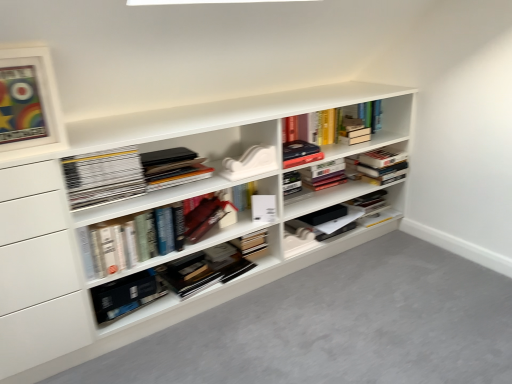
Question: Does white matte paperback book at center, positioned as the 1th paperback book in right-to-left order, have a greater width compared to white matte bookshelf at center?

Choices:
 (A) yes
 (B) no

Answer: (B)

Question: Is white matte paperback book at center, the 2th paperback book ordered from the bottom, next to white matte bookshelf at center?

Choices:
 (A) yes
 (B) no

Answer: (B)

Question: Is the position of white matte paperback book at center, the first paperback book viewed from the top, more distant than that of white matte bookshelf at center?

Choices:
 (A) no
 (B) yes

Answer: (B)

Question: Considering the relative positions of white matte paperback book at center, the second paperback book in the left-to-right sequence, and white matte bookshelf at center in the image provided, is white matte paperback book at center, the second paperback book in the left-to-right sequence, to the left of white matte bookshelf at center from the viewer's perspective?

Choices:
 (A) yes
 (B) no

Answer: (B)

Question: From the image's perspective, is white matte paperback book at center, the first paperback book viewed from the top, on top of white matte bookshelf at center?

Choices:
 (A) yes
 (B) no

Answer: (B)

Question: In terms of width, does matte black book at center, the 3th book from the bottom, look wider or thinner when compared to white matte bookshelf at center?

Choices:
 (A) thin
 (B) wide

Answer: (A)

Question: Is matte black book at center, which ranks as the first book in top-to-bottom order, bigger or smaller than white matte bookshelf at center?

Choices:
 (A) big
 (B) small

Answer: (B)

Question: Is matte black book at center, the 3th book from the bottom, situated inside white matte bookshelf at center or outside?

Choices:
 (A) outside
 (B) inside

Answer: (B)

Question: In the image, is matte black book at center, which ranks as the first book in top-to-bottom order, positioned in front of or behind white matte bookshelf at center?

Choices:
 (A) front
 (B) behind

Answer: (B)

Question: Considering their positions, is white matte paperback book at center, the second paperback book in the left-to-right sequence, located in front of or behind matte black box at center?

Choices:
 (A) front
 (B) behind

Answer: (A)

Question: Is white matte paperback book at center, positioned as the 1th paperback book in right-to-left order, situated inside matte black box at center or outside?

Choices:
 (A) outside
 (B) inside

Answer: (A)

Question: Looking at the image, does white matte paperback book at center, positioned as the 1th paperback book in right-to-left order, seem bigger or smaller compared to matte black box at center?

Choices:
 (A) big
 (B) small

Answer: (B)

Question: Is white matte paperback book at center, the first paperback book viewed from the top, taller or shorter than matte black box at center?

Choices:
 (A) short
 (B) tall

Answer: (A)

Question: Would you say matte white picture frame at upper left is to the left or to the right of hardcover book at center, placed as the second book when sorted from top to bottom, in the picture?

Choices:
 (A) right
 (B) left

Answer: (B)

Question: Considering the positions of point (8, 135) and point (207, 226), is point (8, 135) closer or farther from the camera than point (207, 226)?

Choices:
 (A) farther
 (B) closer

Answer: (B)